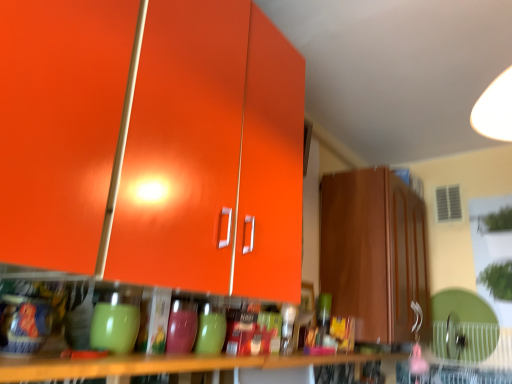
Question: Should I look upward or downward to see glossy orange cabinet at upper left, the 2th cabinetry viewed from the right?

Choices:
 (A) up
 (B) down

Answer: (A)

Question: Is matte brown cabinet at right, the first cabinetry viewed from the right, a part of wooden table at lower center?

Choices:
 (A) no
 (B) yes

Answer: (A)

Question: From a real-world perspective, is wooden table at lower center over matte brown cabinet at right, the 2th cabinetry viewed from the front?

Choices:
 (A) yes
 (B) no

Answer: (B)

Question: Is wooden table at lower center outside of matte brown cabinet at right, the second cabinetry when ordered from left to right?

Choices:
 (A) no
 (B) yes

Answer: (B)

Question: Does wooden table at lower center lie behind matte brown cabinet at right, the second cabinetry when ordered from left to right?

Choices:
 (A) yes
 (B) no

Answer: (B)

Question: Is wooden table at lower center next to matte brown cabinet at right, the 1th cabinetry in the back-to-front sequence?

Choices:
 (A) no
 (B) yes

Answer: (A)

Question: Could you tell me if wooden table at lower center is facing matte brown cabinet at right, the first cabinetry viewed from the right?

Choices:
 (A) no
 (B) yes

Answer: (A)

Question: Is wooden table at lower center smaller than glossy orange cabinet at upper left, arranged as the 1th cabinetry when viewed from the front?

Choices:
 (A) yes
 (B) no

Answer: (A)

Question: Is wooden table at lower center positioned before glossy orange cabinet at upper left, the 2th cabinetry viewed from the right?

Choices:
 (A) yes
 (B) no

Answer: (B)

Question: Can you see wooden table at lower center touching glossy orange cabinet at upper left, the 2th cabinetry viewed from the right?

Choices:
 (A) yes
 (B) no

Answer: (B)

Question: Is glossy orange cabinet at upper left, which is the 1th cabinetry from left to right, a part of wooden table at lower center?

Choices:
 (A) no
 (B) yes

Answer: (A)

Question: From a real-world perspective, is wooden table at lower center physically below glossy orange cabinet at upper left, arranged as the 1th cabinetry when viewed from the front?

Choices:
 (A) no
 (B) yes

Answer: (B)

Question: Could you tell me if wooden table at lower center is facing glossy orange cabinet at upper left, which is the 1th cabinetry from left to right?

Choices:
 (A) no
 (B) yes

Answer: (A)

Question: Does glossy orange cabinet at upper left, arranged as the 1th cabinetry when viewed from the front, appear on the left side of wooden table at lower center?

Choices:
 (A) yes
 (B) no

Answer: (B)